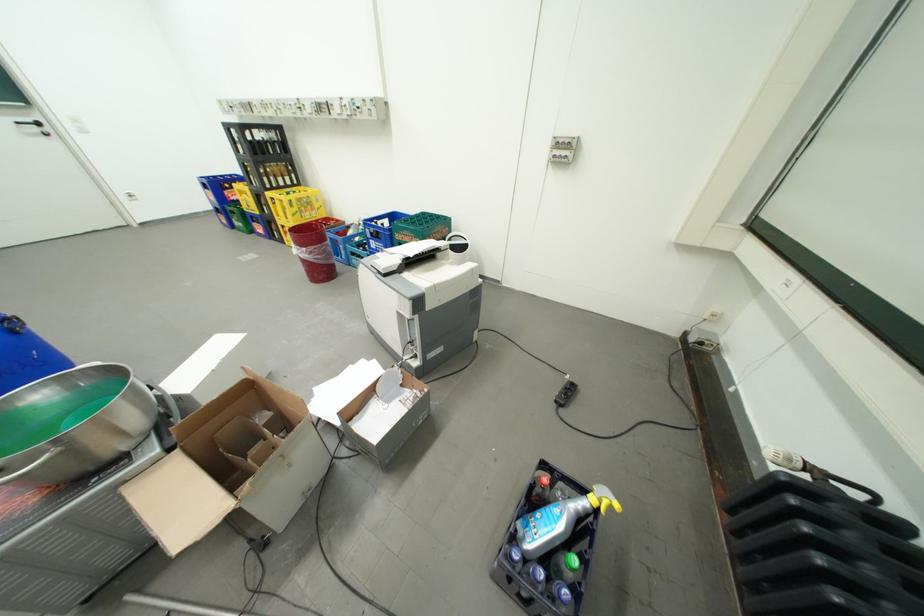
The image size is (924, 616). Find the location of `white radiator valve`. white radiator valve is located at coordinates (783, 458).